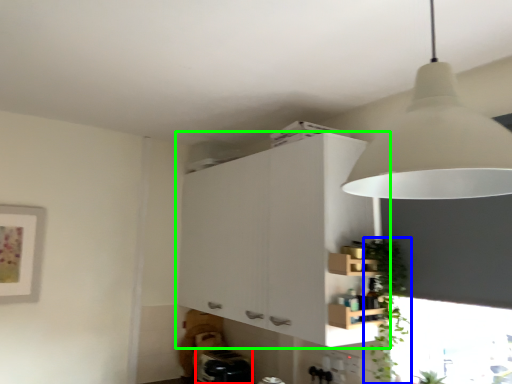
Question: Estimate the real-world distances between objects in this image. Which object is farther from appliance (highlighted by a red box), plant (highlighted by a blue box) or cabinetry (highlighted by a green box)?

Choices:
 (A) plant
 (B) cabinetry

Answer: (A)